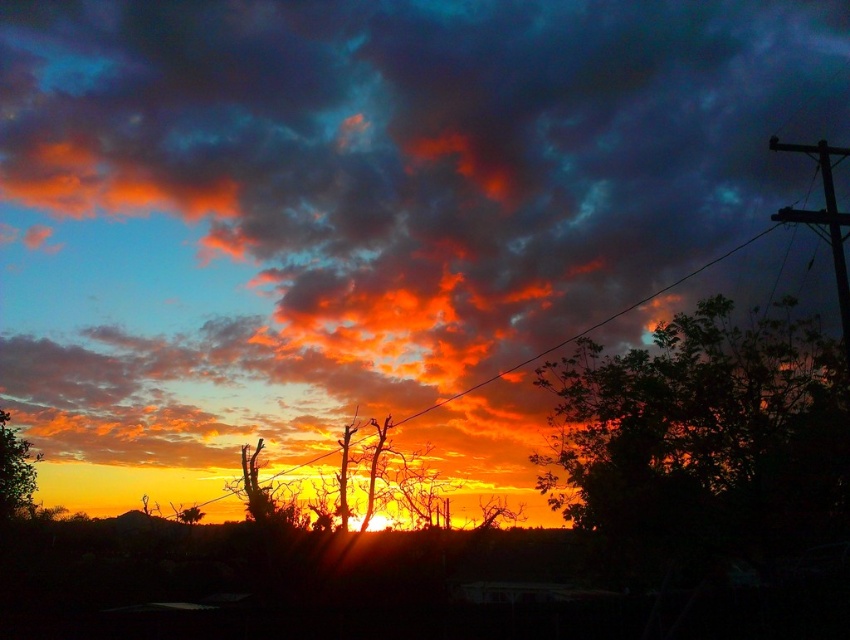
Question: Which point appears farthest from the camera in this image?

Choices:
 (A) (826, 216)
 (B) (833, 440)

Answer: (B)

Question: Does dark green leafy tree at right appear on the right side of green matte tree at lower left?

Choices:
 (A) yes
 (B) no

Answer: (A)

Question: Which point is farther to the camera?

Choices:
 (A) (10, 468)
 (B) (616, 406)

Answer: (A)

Question: Which point appears farthest from the camera in this image?

Choices:
 (A) (820, 161)
 (B) (811, 516)
 (C) (0, 467)

Answer: (C)

Question: Is metallic wire at upper right positioned before green matte tree at lower left?

Choices:
 (A) no
 (B) yes

Answer: (B)

Question: In this image, where is dark green leafy tree at right located relative to metallic wire at upper right?

Choices:
 (A) right
 (B) left

Answer: (B)